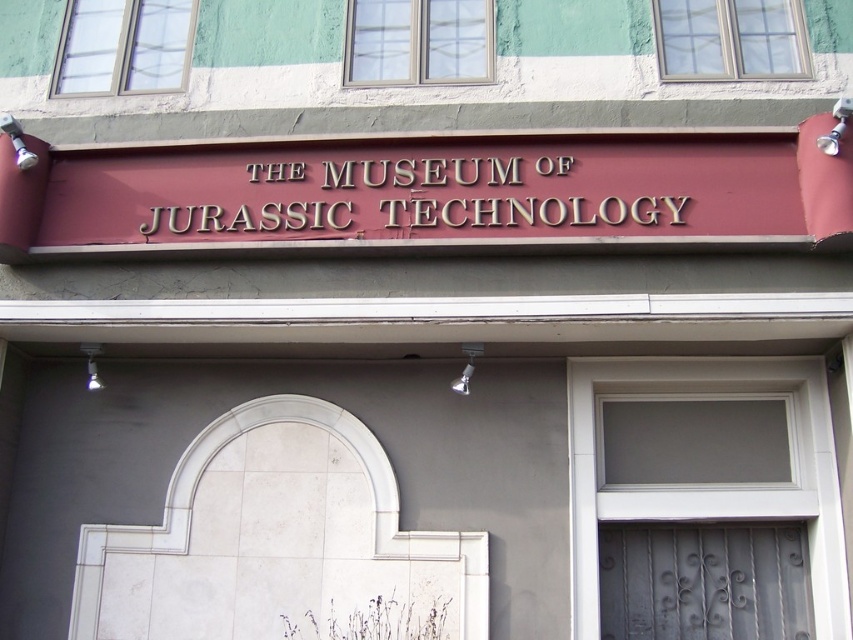
Question: Does white glass door at center appear on the left side of matte gold sign at center?

Choices:
 (A) no
 (B) yes

Answer: (A)

Question: Which point is closer to the camera taking this photo?

Choices:
 (A) pyautogui.click(x=432, y=186)
 (B) pyautogui.click(x=781, y=376)

Answer: (A)

Question: Can you confirm if white glass door at center is positioned below matte gold sign at center?

Choices:
 (A) yes
 (B) no

Answer: (A)

Question: Can you confirm if white glass door at center is smaller than matte gold sign at center?

Choices:
 (A) yes
 (B) no

Answer: (B)